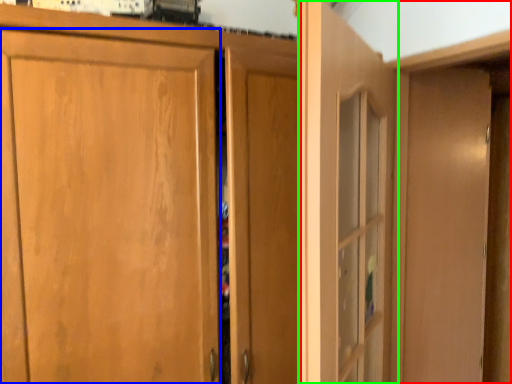
Question: Considering the real-world distances, which object is farthest from dresser (highlighted by a red box)? door (highlighted by a blue box) or door (highlighted by a green box)?

Choices:
 (A) door
 (B) door

Answer: (A)